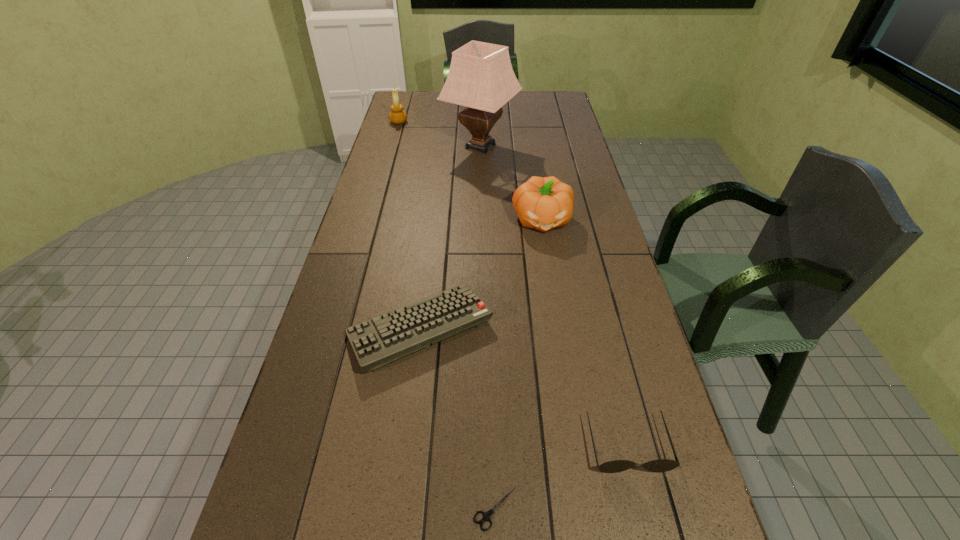
In order to click on lampshade in this screenshot , I will do `click(480, 77)`.

Image resolution: width=960 pixels, height=540 pixels. I want to click on the tallest object, so click(480, 77).

Locate an element on the screen. The image size is (960, 540). the farthest object is located at coordinates (397, 116).

Locate an element on the screen. the fourth nearest object is located at coordinates (544, 203).

This screenshot has height=540, width=960. In order to click on the third shortest object in this screenshot , I will do `click(662, 465)`.

Image resolution: width=960 pixels, height=540 pixels. What are the coordinates of `the fifth farthest object` in the screenshot? It's located at (662, 465).

Find the location of a particular element. Image resolution: width=960 pixels, height=540 pixels. the fourth farthest object is located at coordinates (380, 340).

This screenshot has width=960, height=540. I want to click on computer keyboard, so click(x=380, y=340).

Where is `the nearest object`? Image resolution: width=960 pixels, height=540 pixels. the nearest object is located at coordinates (487, 515).

This screenshot has height=540, width=960. What are the coordinates of `shears` in the screenshot? It's located at (487, 515).